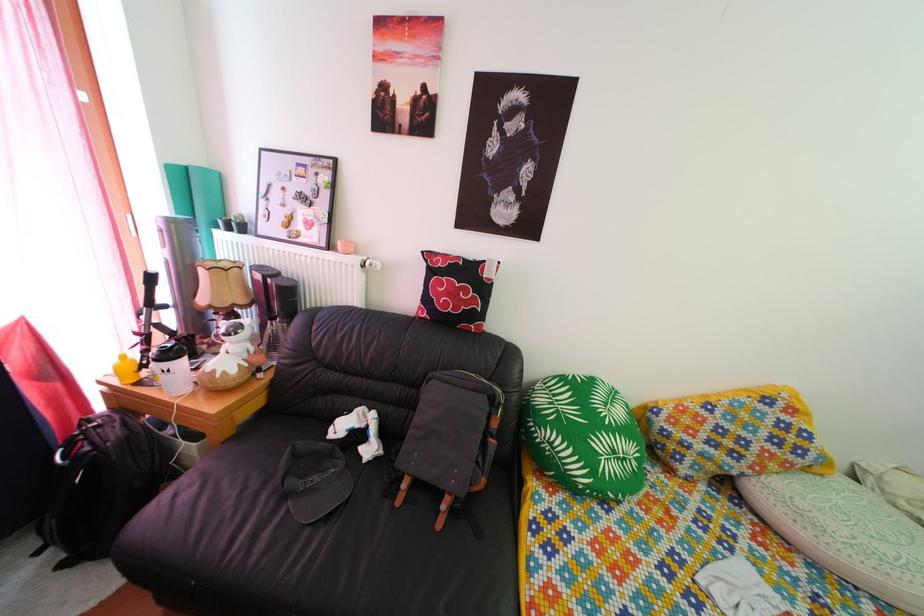
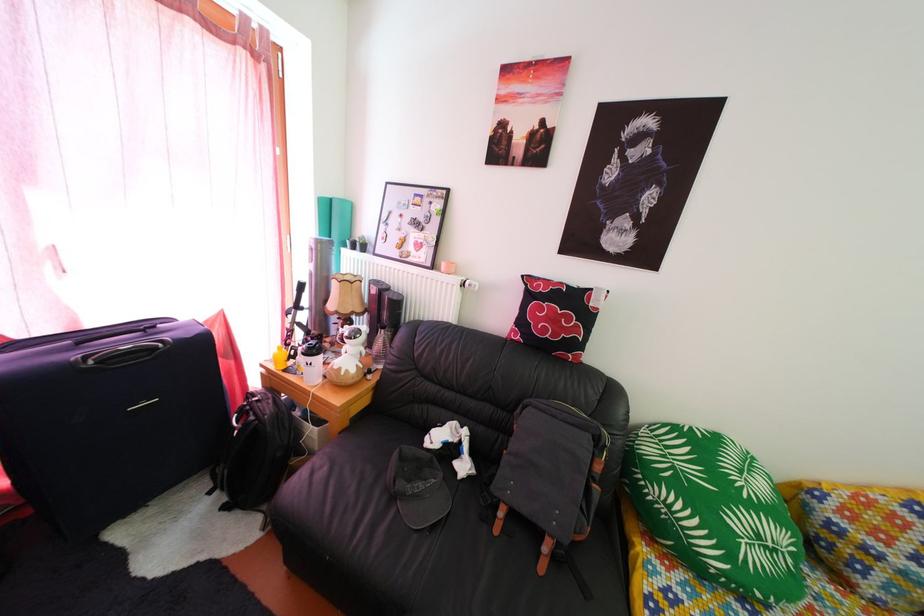
In the second image, find the point that corresponds to point 313,454 in the first image.

(419, 458)